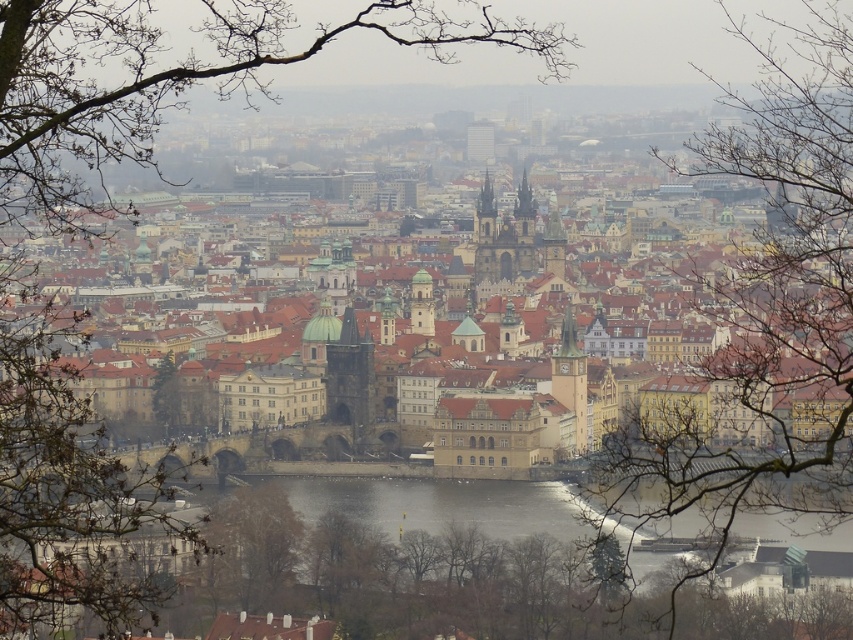
You are an architect planning to install a new lighting system on the dark gray stone tower at center. You need to ensure that the bare branches at upper left do not block the light. Based on the scene, can you determine if the branches are wider than the tower?

The bare branches at upper left might be wider than dark gray stone tower at center, so there is a possibility that they could block the light. Further measurements or on site assessment would be needed to confirm.

Consider the image. You are an artist sketching the cityscape and notice the bare branches at upper left and the dark gray stone tower at center. Which one appears bigger in your drawing?

The bare branches at upper left appears bigger in the drawing because they are closer to the viewer, making them larger than the dark gray stone tower at center which is further away.